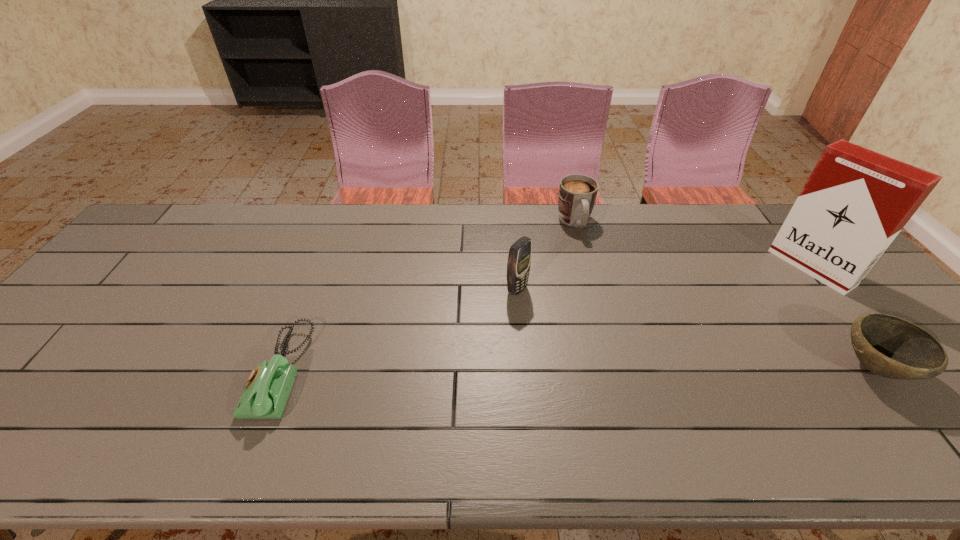
In the image, there is a desktop. In order to click on vacant region at the near edge in this screenshot , I will do `click(328, 393)`.

Find the location of a particular element. The height and width of the screenshot is (540, 960). blank space at the left edge of the desktop is located at coordinates (131, 258).

The image size is (960, 540). In order to click on free space at the near left corner of the desktop in this screenshot , I will do `click(56, 384)`.

Where is `empty space between the leftmost object and the cigarette_case`? This screenshot has height=540, width=960. empty space between the leftmost object and the cigarette_case is located at coordinates (546, 320).

I want to click on free space between the third shortest object and the fourth object from right to left, so click(546, 256).

Where is `free area in between the mug and the fourth object from right to left`? free area in between the mug and the fourth object from right to left is located at coordinates (546, 256).

Locate an element on the screen. vacant space that's between the bowl and the third object from left to right is located at coordinates (725, 295).

This screenshot has height=540, width=960. In order to click on free space between the fourth shortest object and the tallest object in this screenshot , I will do `click(664, 279)`.

Identify the location of empty location between the shortest object and the bowl. This screenshot has width=960, height=540. (578, 369).

Where is `unoccupied area between the cigarette_case and the second tallest object`? unoccupied area between the cigarette_case and the second tallest object is located at coordinates (664, 279).